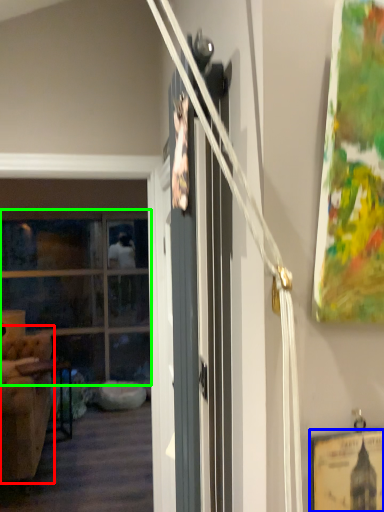
Question: Which object is the farthest from armchair (highlighted by a red box)? Choose among these: picture frame (highlighted by a blue box) or window (highlighted by a green box).

Choices:
 (A) picture frame
 (B) window

Answer: (A)